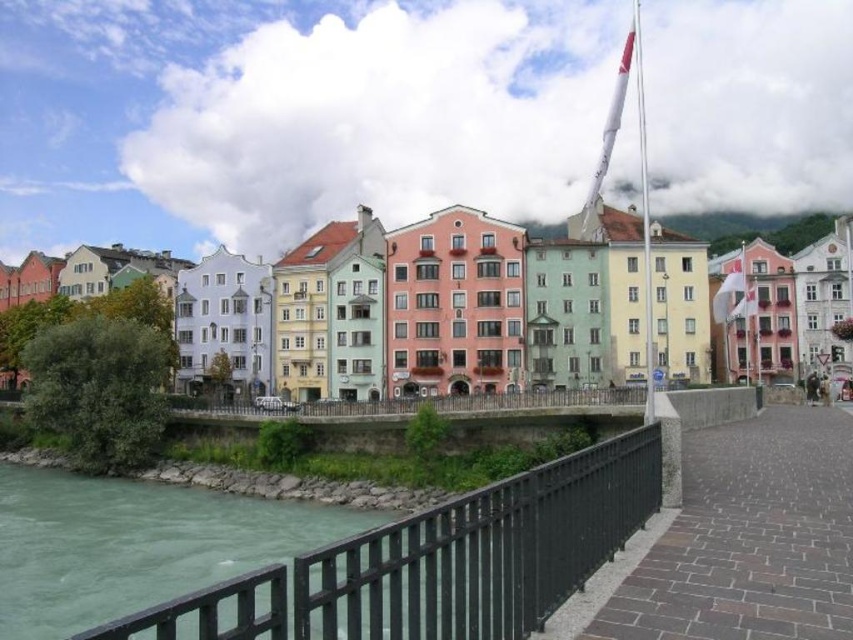
Is black metal railing at lower center further to the viewer compared to green stone river at lower left?

No, black metal railing at lower center is closer to the viewer.

Who is shorter, black metal railing at lower center or green stone river at lower left?

With less height is green stone river at lower left.

Who is more distant from viewer, (328, 588) or (277, 516)?

Positioned behind is point (277, 516).

Identify the location of black metal railing at lower center. (440, 561).

Is black metal railing at lower center to the left of pastel painted buildings at center from the viewer's perspective?

Indeed, black metal railing at lower center is positioned on the left side of pastel painted buildings at center.

Between point (636, 492) and point (608, 224), which one is positioned in front?

Point (636, 492) is in front.

Between point (384, 634) and point (741, 220), which one is positioned behind?

The point (741, 220) is behind.

At what (x,y) coordinates should I click in order to perform the action: click on black metal railing at lower center. Please return your answer as a coordinate pair (x, y). Image resolution: width=853 pixels, height=640 pixels. Looking at the image, I should click on (440, 561).

Is point (238, 513) more distant than point (793, 225)?

No, (238, 513) is in front of (793, 225).

Who is lower down, green stone river at lower left or pastel painted buildings at center?

Positioned lower is green stone river at lower left.

Locate an element on the screen. Image resolution: width=853 pixels, height=640 pixels. green stone river at lower left is located at coordinates (136, 545).

Identify the location of green stone river at lower left. Image resolution: width=853 pixels, height=640 pixels. (136, 545).